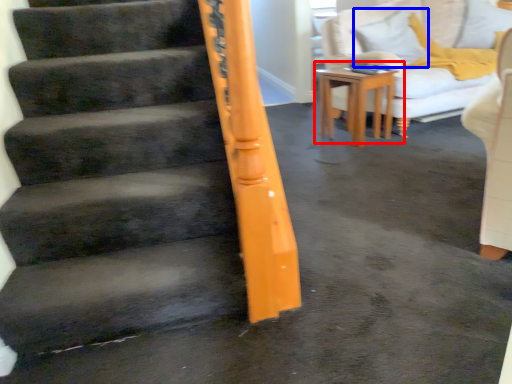
Question: Which object appears closest to the camera in this image, table (highlighted by a red box) or pillow (highlighted by a blue box)?

Choices:
 (A) table
 (B) pillow

Answer: (A)